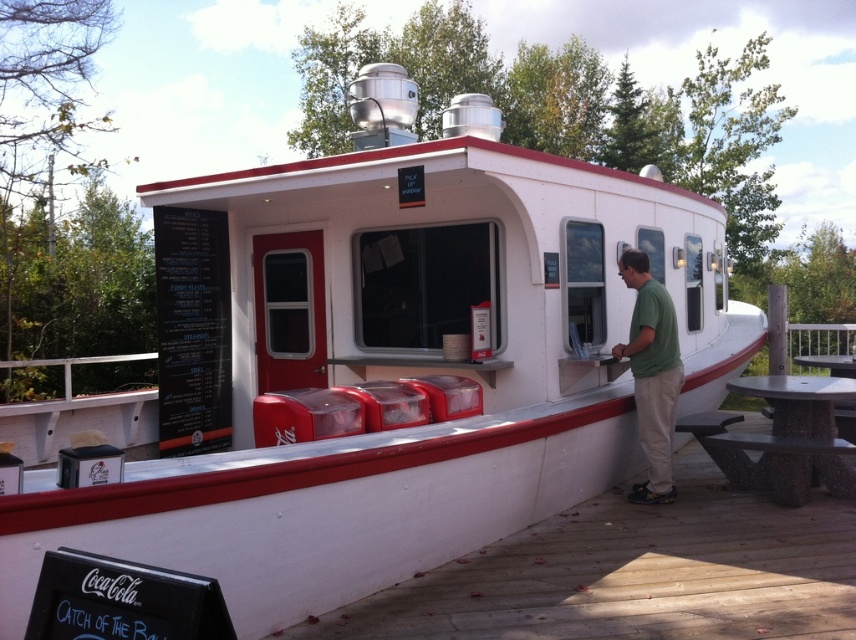
You are a customer waiting in line at the boat shaped food stand. You notice the wooden at lower left and the green cotton shirt at center. Which object is closer to the ground?

The wooden at lower left is positioned under the green cotton shirt at center, so it is closer to the ground.

You are planning to set up a picnic area near the boat structure. You have a large blanket and need to choose between placing it under the wooden at lower left or the dark brown stone picnic table at lower right. Based on size, which surface can accommodate the blanket more comfortably?

The wooden at lower left is bigger than the dark brown stone picnic table at lower right, so it can accommodate the blanket more comfortably.

You are trying to place a large pizza box that is 1 meter wide on the wooden deck. The pizza box must be placed entirely within the wooden deck area. Can the pizza box fit on the wooden deck if you place it near the wooden at lower left and green cotton shirt at center?

The wooden at lower left has a larger width than the green cotton shirt at center. Since the pizza box is 1 meter wide, and the wooden deck area near the wooden at lower left is wider, it should have enough space to accommodate the pizza box. Therefore, the pizza box can fit on the wooden deck near the wooden at lower left.